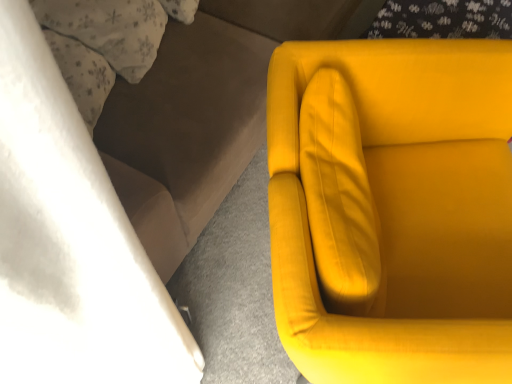
Question: Do you think velvet yellow couch at right is within matte yellow armchair at right, or outside of it?

Choices:
 (A) outside
 (B) inside

Answer: (A)

Question: Would you say velvet yellow couch at right is to the left or to the right of matte yellow armchair at right in the picture?

Choices:
 (A) right
 (B) left

Answer: (B)

Question: From the image's perspective, is velvet yellow couch at right located above or below matte yellow armchair at right?

Choices:
 (A) above
 (B) below

Answer: (A)

Question: From the image's perspective, is matte yellow armchair at right positioned above or below velvet yellow couch at right?

Choices:
 (A) below
 (B) above

Answer: (A)

Question: Relative to velvet yellow couch at right, is matte yellow armchair at right in front or behind?

Choices:
 (A) front
 (B) behind

Answer: (A)

Question: Is point (509, 155) positioned closer to the camera than point (145, 134)?

Choices:
 (A) closer
 (B) farther

Answer: (B)

Question: Considering the positions of matte yellow armchair at right and velvet yellow couch at right in the image, is matte yellow armchair at right taller or shorter than velvet yellow couch at right?

Choices:
 (A) short
 (B) tall

Answer: (A)